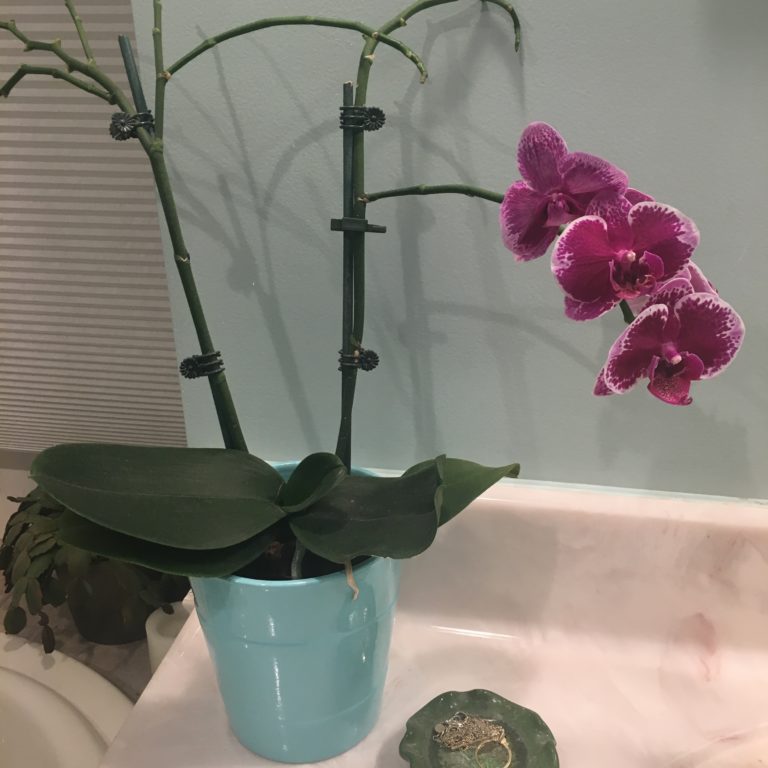
At what (x,y) coordinates should I click in order to perform the action: click on counter top. Please return your answer as a coordinate pair (x, y). Looking at the image, I should click on (606, 672).